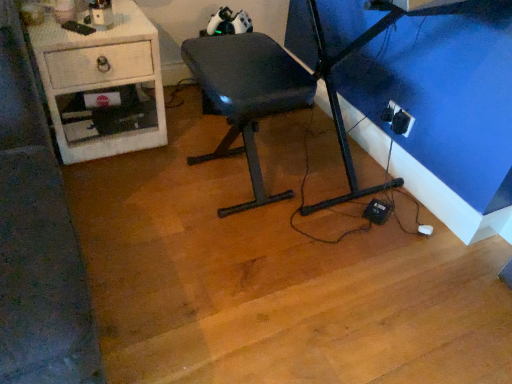
Question: From a real-world perspective, is matte black chair at center physically located above or below white glossy desk at left?

Choices:
 (A) above
 (B) below

Answer: (A)

Question: In terms of width, does matte black chair at center look wider or thinner when compared to white glossy desk at left?

Choices:
 (A) wide
 (B) thin

Answer: (B)

Question: Estimate the real-world distances between objects in this image. Which object is closer to the matte black chair at center?

Choices:
 (A) black plastic outlet at lower right
 (B) white glossy desk at left

Answer: (B)

Question: Estimate the real-world distances between objects in this image. Which object is farther from the black plastic outlet at lower right?

Choices:
 (A) matte black chair at center
 (B) white glossy desk at left

Answer: (B)